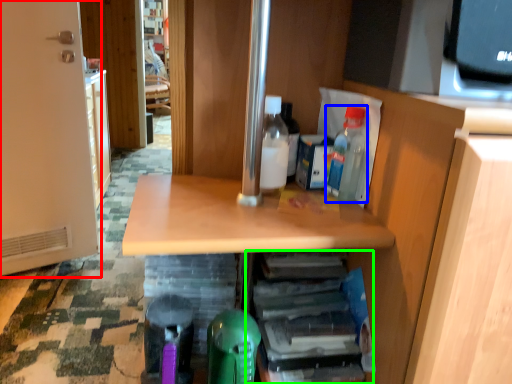
Question: Estimate the real-world distances between objects in this image. Which object is farther from door (highlighted by a red box), bottle (highlighted by a blue box) or shelf (highlighted by a green box)?

Choices:
 (A) bottle
 (B) shelf

Answer: (A)